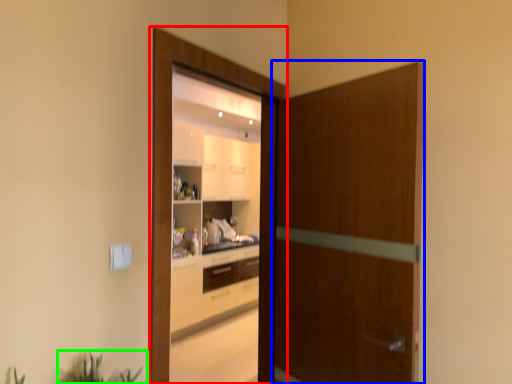
Question: Estimate the real-world distances between objects in this image. Which object is closer to screen door (highlighted by a red box), screen door (highlighted by a blue box) or plant (highlighted by a green box)?

Choices:
 (A) screen door
 (B) plant

Answer: (A)